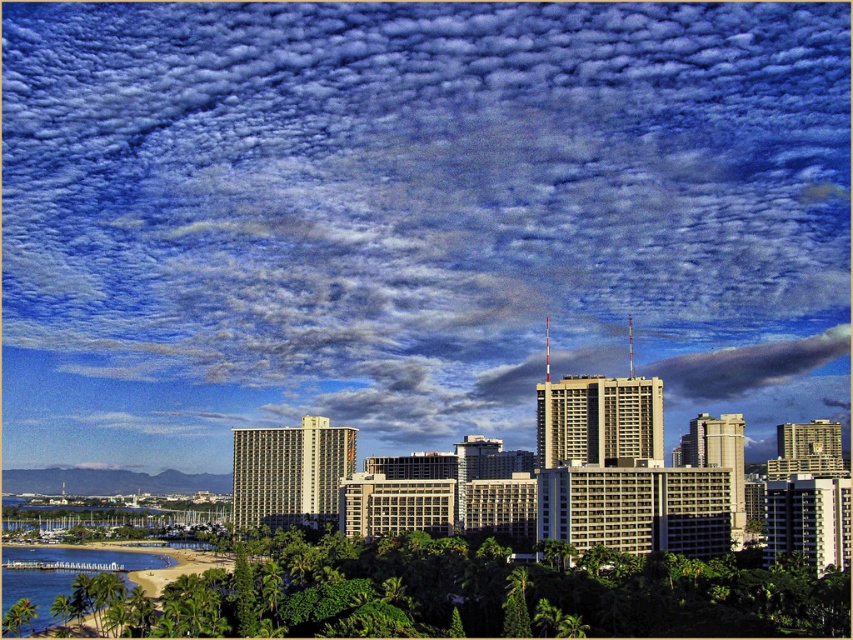
Question: Which of the following is the closest to the observer?

Choices:
 (A) (706, 371)
 (B) (9, 582)

Answer: (B)

Question: Which of the following is the farthest from the observer?

Choices:
 (A) gray/cloudy sky at center
 (B) cloudy sky at upper center

Answer: (A)

Question: Does cloudy sky at upper center have a greater width compared to gray/cloudy sky at center?

Choices:
 (A) yes
 (B) no

Answer: (A)

Question: Is the position of cloudy sky at upper center more distant than that of gray/cloudy sky at center?

Choices:
 (A) no
 (B) yes

Answer: (A)

Question: Does cloudy sky at upper center appear on the right side of gray/cloudy sky at center?

Choices:
 (A) yes
 (B) no

Answer: (B)

Question: Which object is the farthest from the clear blue water at lower left?

Choices:
 (A) cloudy sky at upper center
 (B) gray/cloudy sky at center

Answer: (A)